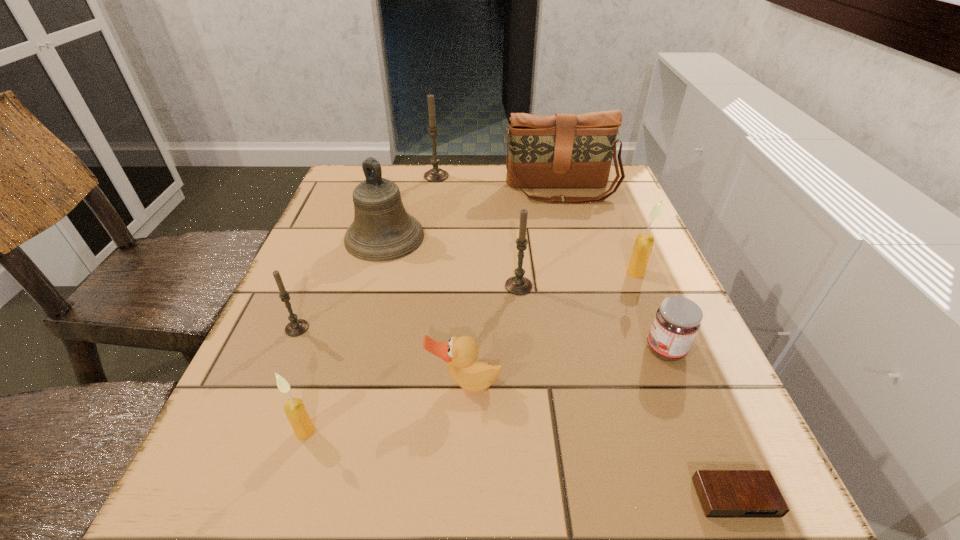
Where is `vacant region at the far left corner`? This screenshot has height=540, width=960. vacant region at the far left corner is located at coordinates (349, 188).

This screenshot has height=540, width=960. In the image, there is a desktop. Find the location of `vacant space at the far right corner`. vacant space at the far right corner is located at coordinates (618, 204).

Locate an element on the screen. vacant space in between the third candle from left to right and the tan duck is located at coordinates (450, 280).

Identify the location of blank region between the smaller cream candle and the shoulder bag. This screenshot has height=540, width=960. (433, 312).

The height and width of the screenshot is (540, 960). Identify the location of empty location between the shoulder bag and the farthest gray candle. (498, 184).

Locate an element on the screen. empty location between the red jam and the nearer cream candle is located at coordinates (485, 390).

What are the coordinates of `free spot between the tallest candle and the alarm clock` in the screenshot? It's located at (586, 337).

You are a GUI agent. You are given a task and a screenshot of the screen. Output one action in this format:
    pyautogui.click(x=<x>, y=<y>)
    Task: Click on the free space between the red jam and the fourth candle from left to right
    
    Given the screenshot: What is the action you would take?
    pyautogui.click(x=592, y=318)

At what (x,y) coordinates should I click in order to perform the action: click on free area in between the black alarm clock and the jam. Please return your answer as a coordinate pair (x, y). Looking at the image, I should click on (700, 424).

This screenshot has width=960, height=540. In order to click on vacant area between the alarm clock and the shoulder bag in this screenshot , I will do `click(648, 345)`.